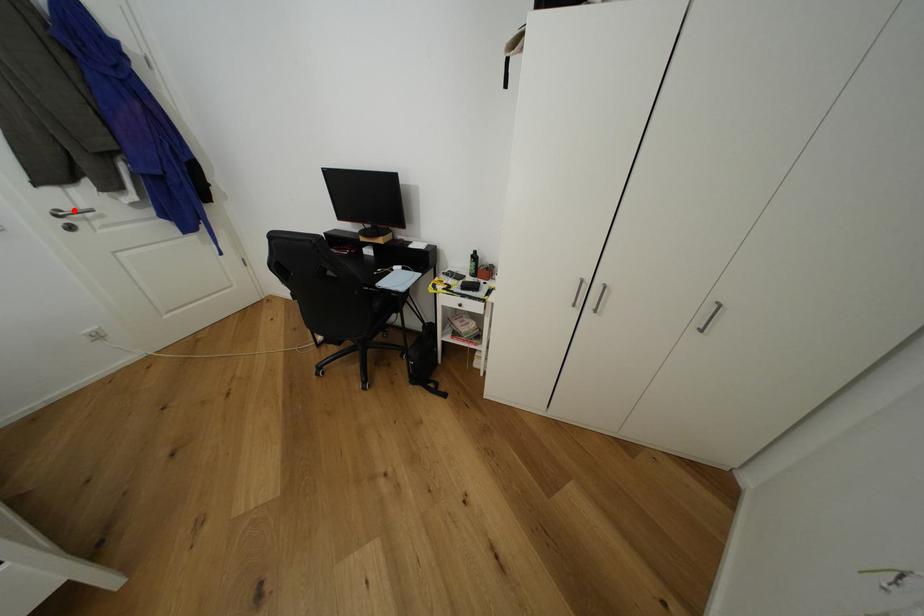
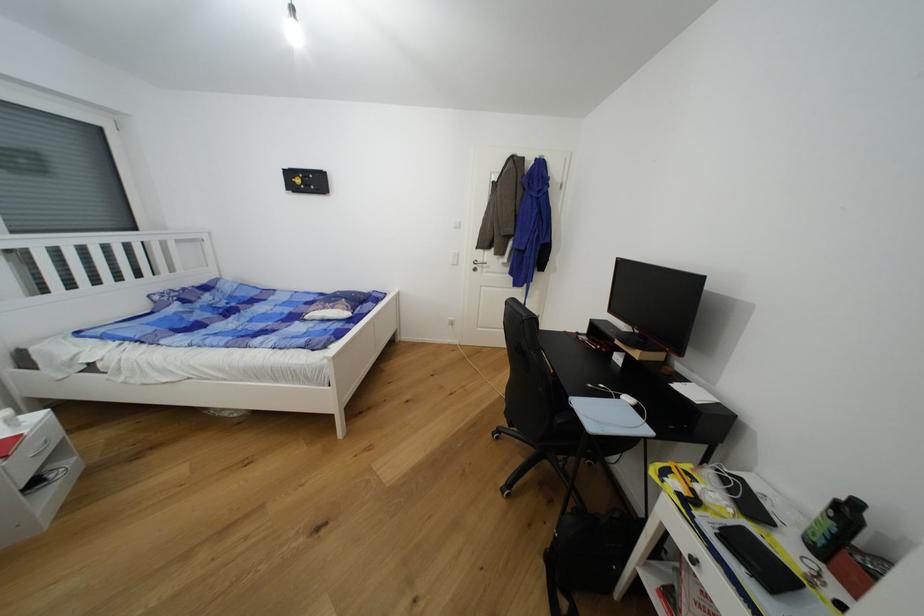
Question: I am providing you with two images of the same scene from different viewpoints. A red point is shown in image1. For the corresponding object point in image2, is it positioned nearer or farther from the camera?

Choices:
 (A) Nearer
 (B) Farther

Answer: (A)